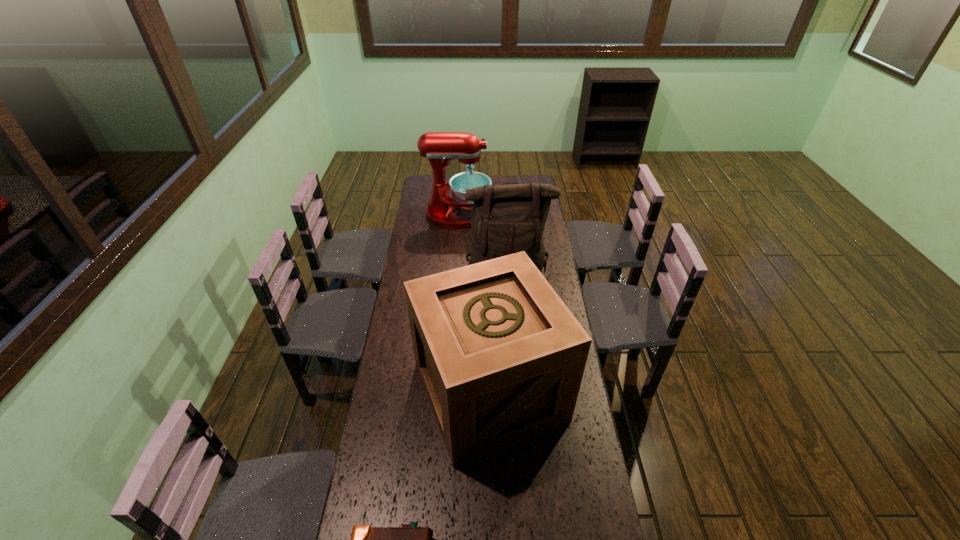
The width and height of the screenshot is (960, 540). In order to click on free region at the left edge of the desktop in this screenshot , I will do `click(420, 258)`.

This screenshot has width=960, height=540. In order to click on vacant area at the right edge in this screenshot , I will do `click(556, 539)`.

Where is `the closest object relative to the farthest object`? the closest object relative to the farthest object is located at coordinates (506, 219).

Find the location of a particular element. object that is the third closest one to the nearest object is located at coordinates (440, 148).

Locate an element on the screen. The image size is (960, 540). vacant space that satisfies the following two spatial constraints: 1. on the front-facing side of the box; 2. on the right side of the mixer is located at coordinates point(445,392).